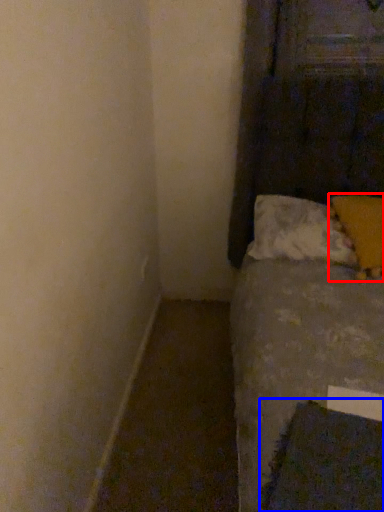
Question: Which point is closer to the camera, pillow (highlighted by a red box) or sheet (highlighted by a blue box)?

Choices:
 (A) pillow
 (B) sheet

Answer: (B)